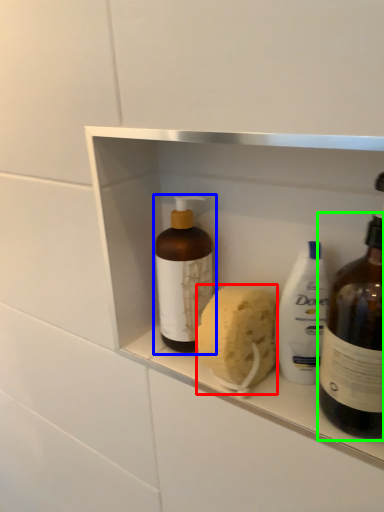
Question: Estimate the real-world distances between objects in this image. Which object is closer to soap (highlighted by a red box), bottle (highlighted by a blue box) or bottle (highlighted by a green box)?

Choices:
 (A) bottle
 (B) bottle

Answer: (A)